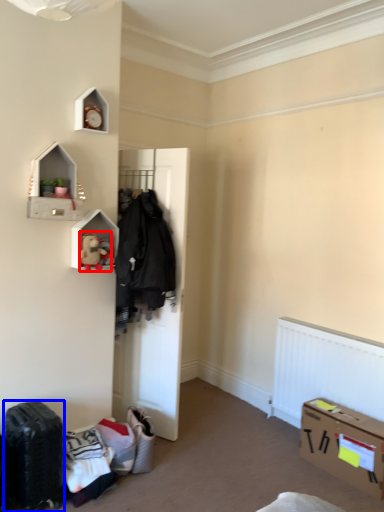
Question: Among these objects, which one is nearest to the camera, toy (highlighted by a red box) or luggage (highlighted by a blue box)?

Choices:
 (A) toy
 (B) luggage

Answer: (B)